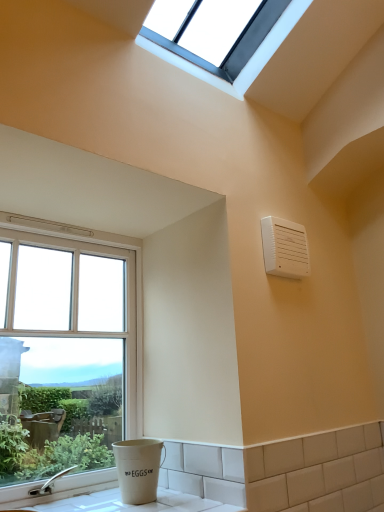
Identify the location of clear glass window at left, marked as the 2th window in a top-to-bottom arrangement. (69, 348).

Image resolution: width=384 pixels, height=512 pixels. What are the coordinates of `white plastic air conditioning unit at upper right` in the screenshot? It's located at (284, 248).

You are a GUI agent. You are given a task and a screenshot of the screen. Output one action in this format:
    pyautogui.click(x=<x>, y=<y>)
    Task: Click on the clear glass window at left, placed as the first window when sorted from bottom to top
    
    Given the screenshot: What is the action you would take?
    pyautogui.click(x=69, y=348)

Which is more to the left, clear glass window at left, marked as the 2th window in a top-to-bottom arrangement, or clear glass window at upper center, the first window positioned from the top?

clear glass window at left, marked as the 2th window in a top-to-bottom arrangement.

Which is behind, clear glass window at left, marked as the 2th window in a top-to-bottom arrangement, or clear glass window at upper center, positioned as the 2th window in left-to-right order?

clear glass window at left, marked as the 2th window in a top-to-bottom arrangement, is more distant.

Which point is more distant from viewer, (80, 440) or (255, 63)?

The point (255, 63) is behind.

Is clear glass window at left, placed as the 2th window when sorted from right to left, bigger than clear glass window at upper center, the 2th window in the bottom-to-top sequence?

No.

From the image's perspective, is clear glass window at upper center, the 1th window positioned from the right, above or below white plastic air conditioning unit at upper right?

Based on their image positions, clear glass window at upper center, the 1th window positioned from the right, is located above white plastic air conditioning unit at upper right.

Considering the relative sizes of clear glass window at upper center, the 1th window positioned from the right, and white plastic air conditioning unit at upper right in the image provided, is clear glass window at upper center, the 1th window positioned from the right, thinner than white plastic air conditioning unit at upper right?

No.

Is clear glass window at upper center, positioned as the 2th window in left-to-right order, far from white plastic air conditioning unit at upper right?

No, clear glass window at upper center, positioned as the 2th window in left-to-right order, is not far away from white plastic air conditioning unit at upper right.

From a real-world perspective, is white ceramic counter top at lower left on clear glass window at upper center, the 1th window positioned from the right?

No, from a real-world perspective, white ceramic counter top at lower left is not on top of clear glass window at upper center, the 1th window positioned from the right.

From the image's perspective, between white ceramic counter top at lower left and clear glass window at upper center, the 2th window in the bottom-to-top sequence, who is located below?

From the image's view, white ceramic counter top at lower left is below.

Would you say white ceramic counter top at lower left is inside or outside clear glass window at upper center, the first window positioned from the top?

white ceramic counter top at lower left is located beyond the bounds of clear glass window at upper center, the first window positioned from the top.

Is there a large distance between white ceramic counter top at lower left and clear glass window at upper center, the first window positioned from the top?

white ceramic counter top at lower left is far away from clear glass window at upper center, the first window positioned from the top.

I want to click on air conditioning below the clear glass window at upper center, the 1th window positioned from the right (from the image's perspective), so click(284, 248).

Considering the sizes of objects white plastic air conditioning unit at upper right and clear glass window at upper center, positioned as the 2th window in left-to-right order, in the image provided, who is smaller, white plastic air conditioning unit at upper right or clear glass window at upper center, positioned as the 2th window in left-to-right order,?

Smaller between the two is white plastic air conditioning unit at upper right.

How far apart are white plastic air conditioning unit at upper right and clear glass window at upper center, the 1th window positioned from the right?

white plastic air conditioning unit at upper right and clear glass window at upper center, the 1th window positioned from the right, are 25.61 inches apart.

Can you confirm if white plastic air conditioning unit at upper right is positioned to the left of clear glass window at upper center, positioned as the 2th window in left-to-right order?

Incorrect, white plastic air conditioning unit at upper right is not on the left side of clear glass window at upper center, positioned as the 2th window in left-to-right order.

Which point is more distant from viewer, (102, 498) or (20, 400)?

The point (20, 400) is farther from the camera.

Does white ceramic counter top at lower left have a greater height compared to clear glass window at left, placed as the 2th window when sorted from right to left?

No, white ceramic counter top at lower left is not taller than clear glass window at left, placed as the 2th window when sorted from right to left.

From a real-world perspective, is white ceramic counter top at lower left below clear glass window at left, the 1th window in the left-to-right sequence?

Yes, from a real-world perspective, white ceramic counter top at lower left is below clear glass window at left, the 1th window in the left-to-right sequence.

Is white ceramic counter top at lower left facing towards clear glass window at left, placed as the 2th window when sorted from right to left?

No, white ceramic counter top at lower left is not oriented towards clear glass window at left, placed as the 2th window when sorted from right to left.

Looking at their sizes, would you say clear glass window at upper center, the first window positioned from the top, is wider or thinner than white ceramic counter top at lower left?

Clearly, clear glass window at upper center, the first window positioned from the top, has more width compared to white ceramic counter top at lower left.

Considering the positions of points (292, 15) and (86, 497), is point (292, 15) closer to camera compared to point (86, 497)?

No, it is not.

Is clear glass window at upper center, the 1th window positioned from the right, to the left or to the right of white ceramic counter top at lower left in the image?

clear glass window at upper center, the 1th window positioned from the right, is to the right of white ceramic counter top at lower left.

Would you consider clear glass window at upper center, the 2th window in the bottom-to-top sequence, to be distant from white ceramic counter top at lower left?

Yes, clear glass window at upper center, the 2th window in the bottom-to-top sequence, is far from white ceramic counter top at lower left.

Between white plastic air conditioning unit at upper right and white ceramic counter top at lower left, which one has smaller width?

With smaller width is white plastic air conditioning unit at upper right.

Is white plastic air conditioning unit at upper right not within white ceramic counter top at lower left?

That's correct, white plastic air conditioning unit at upper right is outside of white ceramic counter top at lower left.

Is white plastic air conditioning unit at upper right positioned far away from white ceramic counter top at lower left?

They are positioned close to each other.

Is white plastic air conditioning unit at upper right aimed at white ceramic counter top at lower left?

No, white plastic air conditioning unit at upper right is not aimed at white ceramic counter top at lower left.

Find the location of a particular element. This screenshot has height=512, width=384. window on the left of the clear glass window at upper center, the first window positioned from the top is located at coordinates (69, 348).

Where is `air conditioning behind the clear glass window at upper center, positioned as the 2th window in left-to-right order`? air conditioning behind the clear glass window at upper center, positioned as the 2th window in left-to-right order is located at coordinates (284, 248).

Based on their spatial positions, is white plastic air conditioning unit at upper right or clear glass window at upper center, the 2th window in the bottom-to-top sequence, further from clear glass window at left, the 1th window in the left-to-right sequence?

Based on the image, clear glass window at upper center, the 2th window in the bottom-to-top sequence, appears to be further to clear glass window at left, the 1th window in the left-to-right sequence.

In the scene shown: From the image, which object appears to be farther from clear glass window at upper center, the first window positioned from the top, white ceramic counter top at lower left or white plastic air conditioning unit at upper right?

Among the two, white ceramic counter top at lower left is located further to clear glass window at upper center, the first window positioned from the top.

Looking at the image, which one is located closer to white plastic air conditioning unit at upper right, white ceramic counter top at lower left or clear glass window at upper center, the 2th window in the bottom-to-top sequence?

clear glass window at upper center, the 2th window in the bottom-to-top sequence, is closer to white plastic air conditioning unit at upper right.

Based on their spatial positions, is clear glass window at upper center, the first window positioned from the top, or white ceramic counter top at lower left closer to white plastic air conditioning unit at upper right?

Based on the image, clear glass window at upper center, the first window positioned from the top, appears to be nearer to white plastic air conditioning unit at upper right.

Estimate the real-world distances between objects in this image. Which object is closer to clear glass window at upper center, the 1th window positioned from the right, white ceramic counter top at lower left or clear glass window at left, marked as the 2th window in a top-to-bottom arrangement?

The object closer to clear glass window at upper center, the 1th window positioned from the right, is clear glass window at left, marked as the 2th window in a top-to-bottom arrangement.

Estimate the real-world distances between objects in this image. Which object is closer to white ceramic counter top at lower left, clear glass window at left, marked as the 2th window in a top-to-bottom arrangement, or clear glass window at upper center, the 2th window in the bottom-to-top sequence?

clear glass window at left, marked as the 2th window in a top-to-bottom arrangement.

From the picture: Looking at the image, which one is located further to white ceramic counter top at lower left, white plastic air conditioning unit at upper right or clear glass window at left, placed as the 2th window when sorted from right to left?

The object further to white ceramic counter top at lower left is white plastic air conditioning unit at upper right.

Considering their positions, is white ceramic counter top at lower left positioned further to white plastic air conditioning unit at upper right than clear glass window at left, placed as the first window when sorted from bottom to top?

The object further to white plastic air conditioning unit at upper right is white ceramic counter top at lower left.

What are the coordinates of `window between clear glass window at upper center, the 2th window in the bottom-to-top sequence, and white ceramic counter top at lower left, in the vertical direction` in the screenshot? It's located at (69, 348).

Image resolution: width=384 pixels, height=512 pixels. I want to click on counter top situated between clear glass window at left, the 1th window in the left-to-right sequence, and white plastic air conditioning unit at upper right from left to right, so click(x=136, y=505).

This screenshot has height=512, width=384. In order to click on air conditioning between clear glass window at upper center, the 2th window in the bottom-to-top sequence, and clear glass window at left, the 1th window in the left-to-right sequence, vertically in this screenshot , I will do `click(284, 248)`.

Identify the location of air conditioning between clear glass window at upper center, positioned as the 2th window in left-to-right order, and white ceramic counter top at lower left vertically. (284, 248).